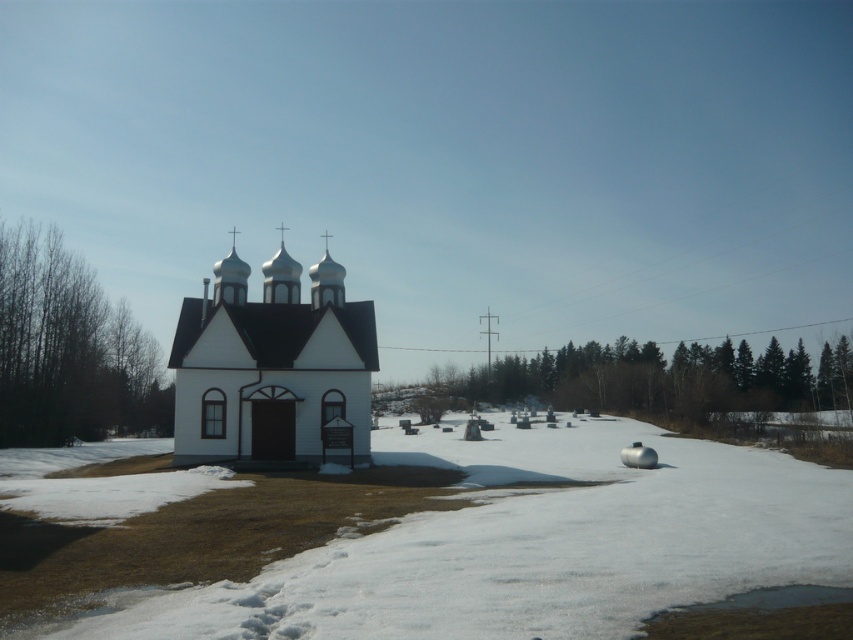
Question: Is the position of white powdery snow at lower center less distant than that of white matte church at center?

Choices:
 (A) yes
 (B) no

Answer: (A)

Question: Among these points, which one is farthest from the camera?

Choices:
 (A) (788, 460)
 (B) (213, 285)

Answer: (A)

Question: Does silver metallic dome at center appear on the left side of white metallic dome at center?

Choices:
 (A) yes
 (B) no

Answer: (B)

Question: Can you confirm if white matte church at center is positioned above white metallic spire at center?

Choices:
 (A) no
 (B) yes

Answer: (A)

Question: Which object appears farthest from the camera in this image?

Choices:
 (A) white matte church at center
 (B) white metallic spire at center
 (C) silver metallic dome at center
 (D) white metallic dome at center

Answer: (C)

Question: Which of the following is the farthest from the observer?

Choices:
 (A) (238, 282)
 (B) (212, 323)
 (C) (311, 300)
 (D) (302, 595)

Answer: (C)